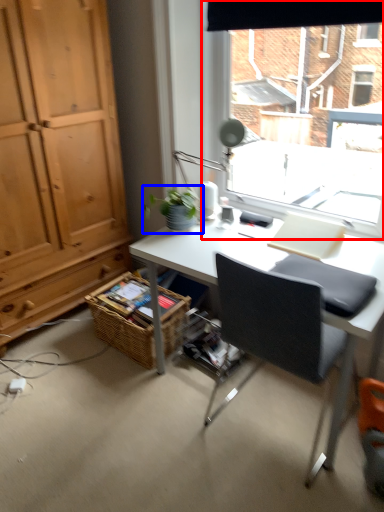
Question: Among these objects, which one is farthest to the camera, window (highlighted by a red box) or houseplant (highlighted by a blue box)?

Choices:
 (A) window
 (B) houseplant

Answer: (B)